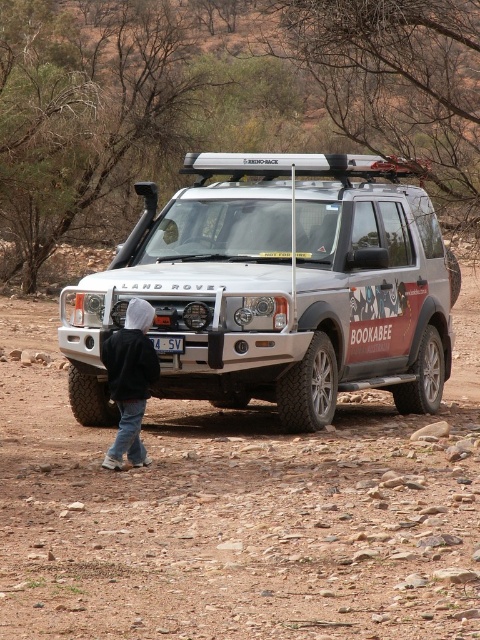
Does silver metallic jeep at center lie behind black hoodie at lower left?

Yes, silver metallic jeep at center is further from the viewer.

Does silver metallic jeep at center have a lesser height compared to black hoodie at lower left?

Yes, silver metallic jeep at center is shorter than black hoodie at lower left.

What do you see at coordinates (276, 289) in the screenshot? I see `silver metallic jeep at center` at bounding box center [276, 289].

The image size is (480, 640). In order to click on silver metallic jeep at center in this screenshot , I will do `click(276, 289)`.

Is dirt track at center taller than black hoodie at lower left?

No.

Who is more forward, (370, 637) or (132, 339)?

Point (370, 637)

Where is `dirt track at center`? The width and height of the screenshot is (480, 640). dirt track at center is located at coordinates point(236,512).

Does point (120, 422) come farther from viewer compared to point (156, 348)?

No, it is not.

Can you confirm if black hoodie at lower left is positioned below white plastic license plate at center?

Yes, black hoodie at lower left is below white plastic license plate at center.

Does point (118, 337) lie behind point (177, 346)?

No, (118, 337) is closer to viewer.

The width and height of the screenshot is (480, 640). What are the coordinates of `black hoodie at lower left` in the screenshot? It's located at (130, 381).